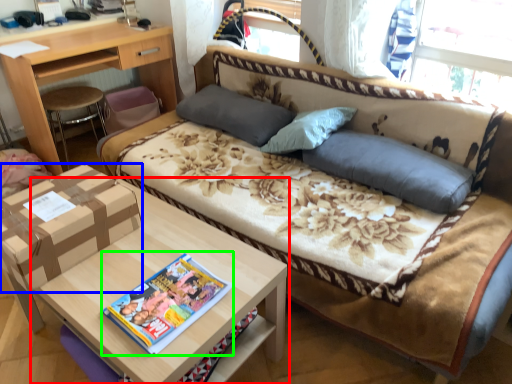
Question: Which object is positioned farthest from table (highlighted by a red box)? Select from cardboard box (highlighted by a blue box) and magazine (highlighted by a green box).

Choices:
 (A) cardboard box
 (B) magazine

Answer: (A)